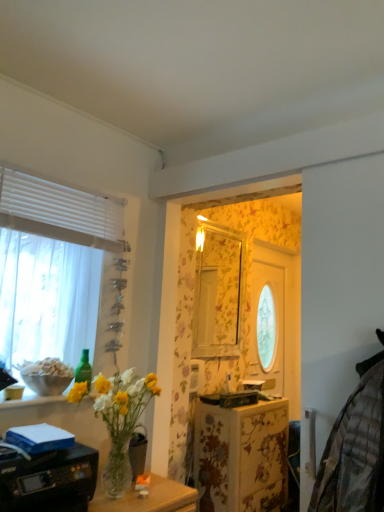
Locate an element on the screen. Image resolution: width=384 pixels, height=512 pixels. vacant space underneath clear glass vase at lower left (from a real-world perspective) is located at coordinates (120, 492).